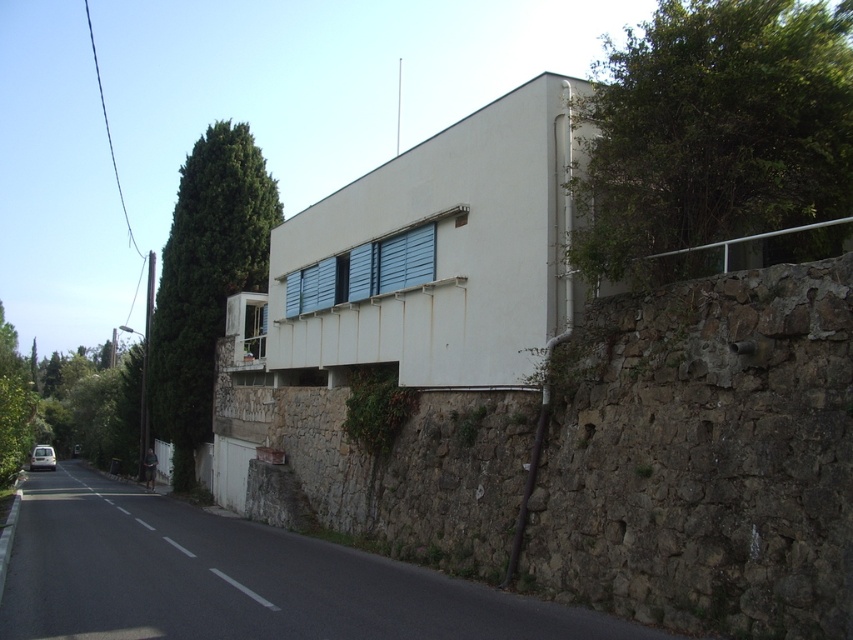
Question: Which object is the farthest from the blue matte window at center?

Choices:
 (A) white matte van at lower left
 (B) white stone wall at center
 (C) green leafy tree at upper right
 (D) green leafy tree at left

Answer: (D)

Question: Where is green leafy tree at upper right located in relation to blue matte window at center in the image?

Choices:
 (A) right
 (B) left

Answer: (A)

Question: Observing the image, what is the correct spatial positioning of white stone wall at center in reference to blue matte window at center?

Choices:
 (A) above
 (B) below

Answer: (B)

Question: Does white stone wall at center appear on the right side of green leafy tree at upper left?

Choices:
 (A) yes
 (B) no

Answer: (A)

Question: Which of the following is the farthest from the observer?

Choices:
 (A) (53, 461)
 (B) (303, 284)

Answer: (A)

Question: Which object appears farthest from the camera in this image?

Choices:
 (A) white stone wall at center
 (B) blue matte window at center
 (C) white matte van at lower left
 (D) green leafy tree at left

Answer: (C)